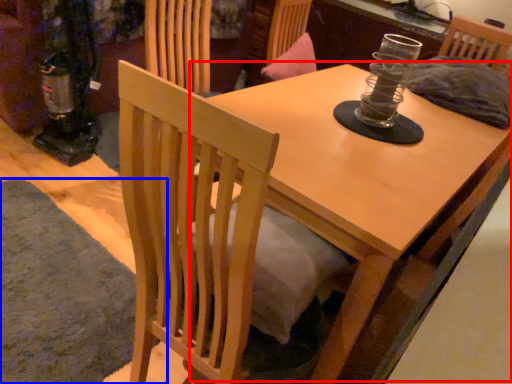
Question: Among these objects, which one is farthest to the camera, round table (highlighted by a red box) or mat (highlighted by a blue box)?

Choices:
 (A) round table
 (B) mat

Answer: (B)